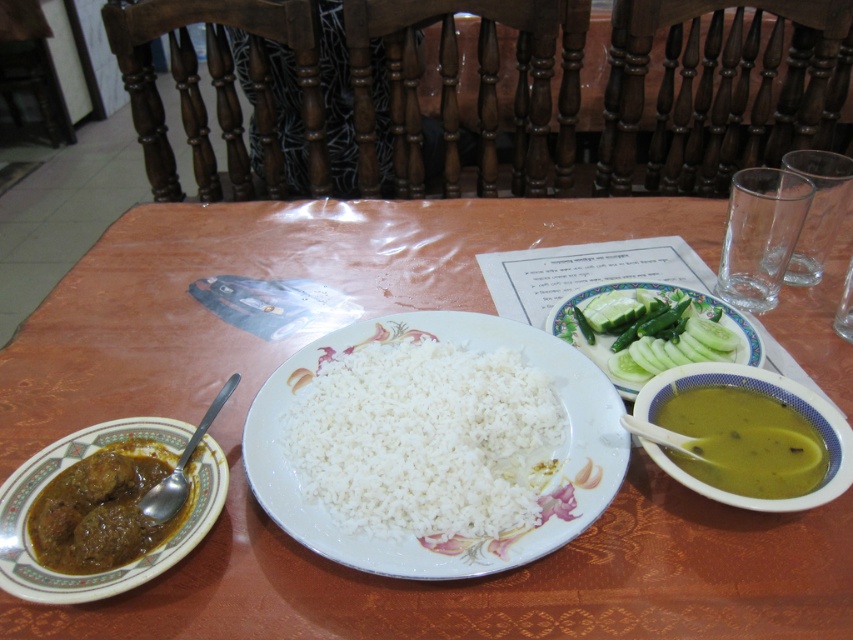
Question: Does brown wooden table at center have a lesser width compared to silver metallic spoon at lower left?

Choices:
 (A) yes
 (B) no

Answer: (B)

Question: Is brown wooden table at center closer to camera compared to green plastic spoon at lower right?

Choices:
 (A) yes
 (B) no

Answer: (A)

Question: Considering the relative positions of brown glossy curry at left and green plastic spoon at lower right in the image provided, where is brown glossy curry at left located with respect to green plastic spoon at lower right?

Choices:
 (A) left
 (B) right

Answer: (A)

Question: Which point is closer to the camera taking this photo?

Choices:
 (A) coord(50,323)
 (B) coord(469,388)
 (C) coord(166,515)

Answer: (C)

Question: Which object is the closest to the white polished rice at center?

Choices:
 (A) green plastic spoon at lower right
 (B) green creamy soup at right
 (C) brown wooden table at center
 (D) brown glossy curry at left

Answer: (A)

Question: Which of the following is the closest to the observer?

Choices:
 (A) silver metallic spoon at lower left
 (B) green plastic spoon at lower right
 (C) white polished rice at center
 (D) sliced green cucumber at center right

Answer: (C)